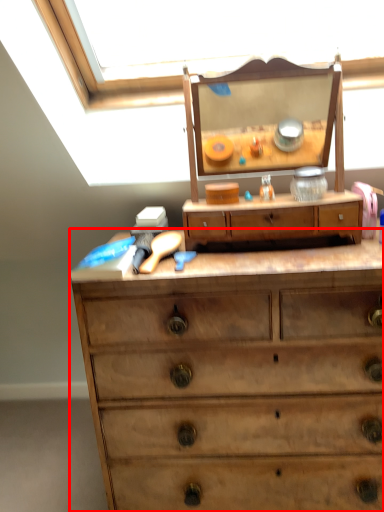
Question: In this image, where is chest of drawers (annotated by the red box) located relative to drawer?

Choices:
 (A) right
 (B) left

Answer: (A)